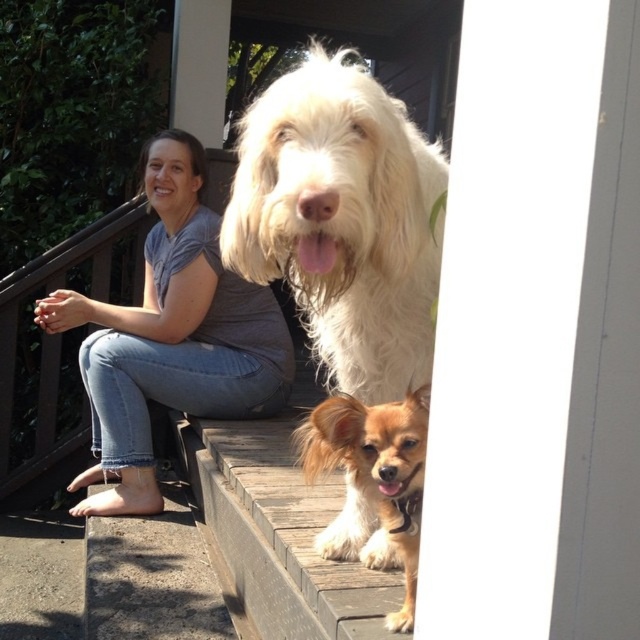
Question: Is white fluffy dog at center further to the viewer compared to gray cotton shirt at upper left?

Choices:
 (A) no
 (B) yes

Answer: (A)

Question: Which point is farther to the camera?

Choices:
 (A) golden fur dog at center
 (B) gray cotton shirt at upper left
 (C) white fluffy dog at center

Answer: (B)

Question: Observing the image, what is the correct spatial positioning of gray cotton shirt at upper left in reference to golden fur dog at center?

Choices:
 (A) below
 (B) above

Answer: (B)

Question: Which point is closer to the camera?

Choices:
 (A) gray cotton shirt at upper left
 (B) white fluffy dog at center

Answer: (B)

Question: Can you confirm if white fluffy dog at center is positioned to the left of golden fur dog at center?

Choices:
 (A) no
 (B) yes

Answer: (B)

Question: Which of these objects is positioned farthest from the golden fur dog at center?

Choices:
 (A) gray cotton shirt at upper left
 (B) white fluffy dog at center

Answer: (A)